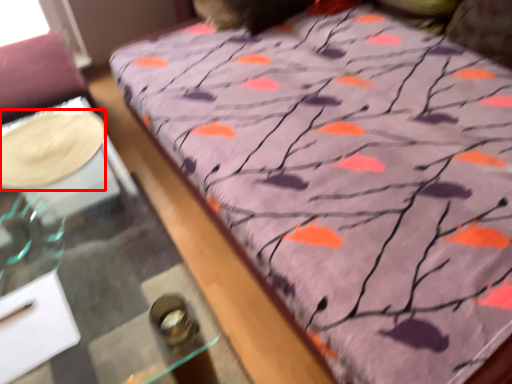
Question: From the image's perspective, where is glass plate (annotated by the red box) located in relation to table in the image?

Choices:
 (A) below
 (B) above

Answer: (B)